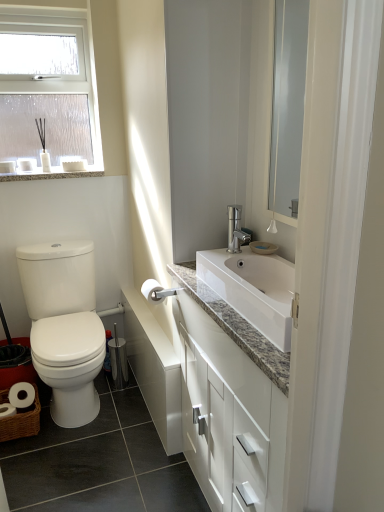
This screenshot has height=512, width=384. I want to click on vacant area that is in front of white glossy toilet at left, so click(x=81, y=442).